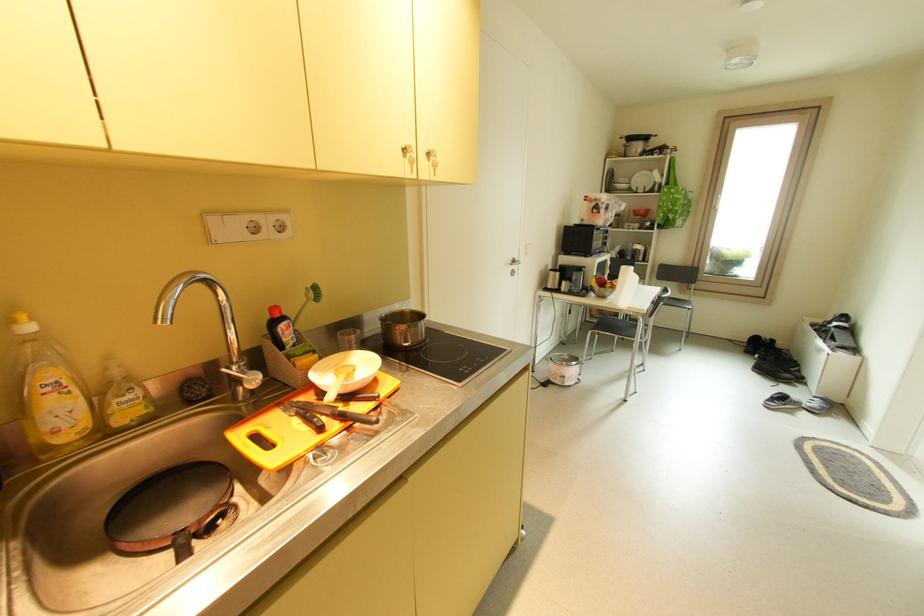
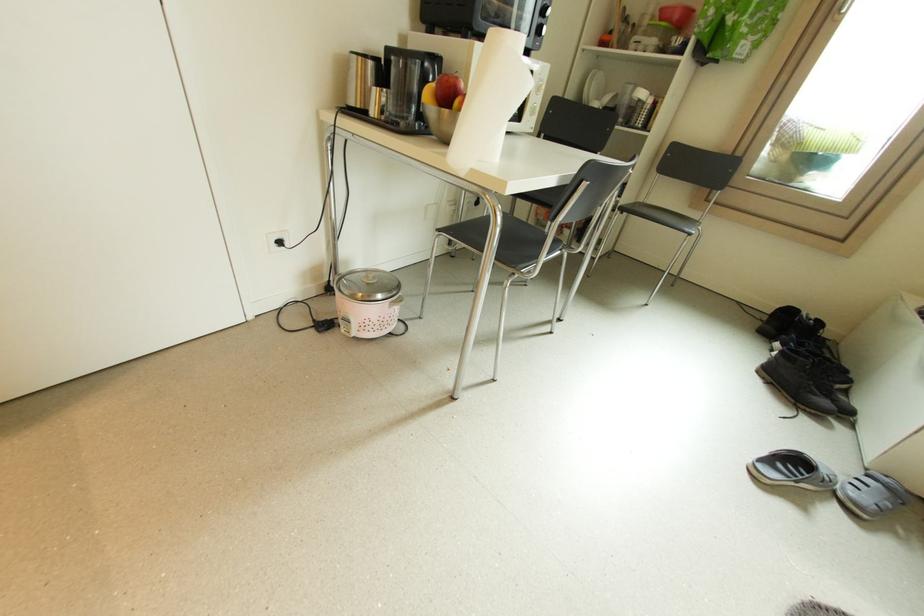
Locate, in the second image, the point that corresponds to point (794, 377) in the first image.

(830, 403)